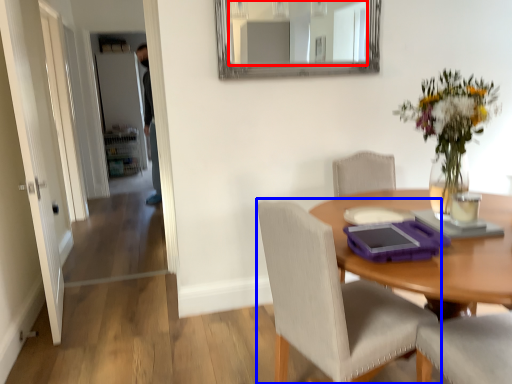
Question: Which object appears farthest to the camera in this image, mirror (highlighted by a red box) or chair (highlighted by a blue box)?

Choices:
 (A) mirror
 (B) chair

Answer: (A)